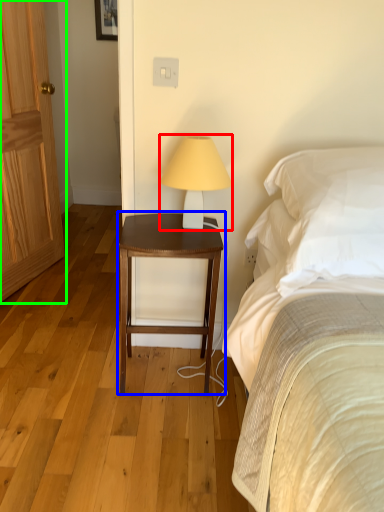
Question: Which is nearer to the table lamp (highlighted by a red box)? nightstand (highlighted by a blue box) or door (highlighted by a green box).

Choices:
 (A) nightstand
 (B) door

Answer: (A)